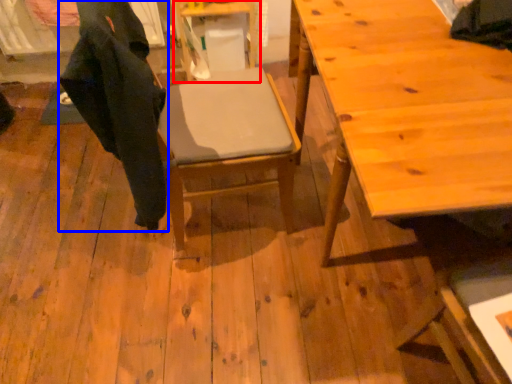
Question: Which point is closer to the camera, table (highlighted by a red box) or robe (highlighted by a blue box)?

Choices:
 (A) table
 (B) robe

Answer: (B)